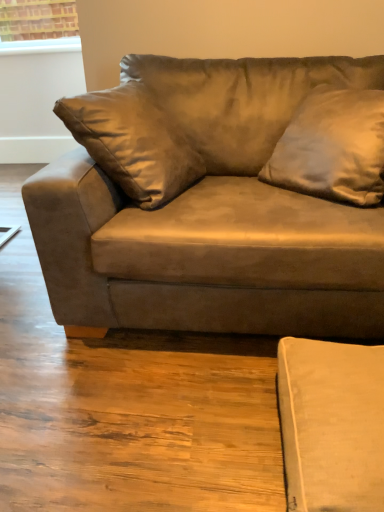
Question: Is suede-like brown couch at center to the left or to the right of satin brown pillow at upper right in the image?

Choices:
 (A) left
 (B) right

Answer: (A)

Question: In the image, is suede-like brown couch at center positioned in front of or behind satin brown pillow at upper right?

Choices:
 (A) behind
 (B) front

Answer: (B)

Question: From their relative heights in the image, would you say suede-like brown couch at center is taller or shorter than satin brown pillow at upper right?

Choices:
 (A) tall
 (B) short

Answer: (A)

Question: From a real-world perspective, is satin brown pillow at upper right positioned above or below suede-like brown couch at center?

Choices:
 (A) above
 (B) below

Answer: (A)

Question: Relative to suede-like brown couch at center, is satin brown pillow at upper right in front or behind?

Choices:
 (A) front
 (B) behind

Answer: (B)

Question: Is point (367, 185) positioned closer to the camera than point (269, 322)?

Choices:
 (A) closer
 (B) farther

Answer: (A)

Question: Which is correct: satin brown pillow at upper right is inside suede-like brown couch at center, or outside of it?

Choices:
 (A) inside
 (B) outside

Answer: (A)